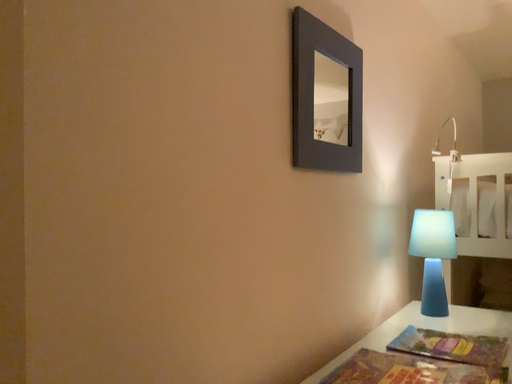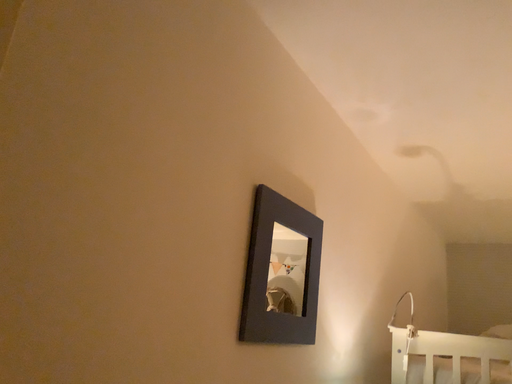
Question: How did the camera likely rotate when shooting the video?

Choices:
 (A) rotated downward
 (B) rotated upward

Answer: (B)